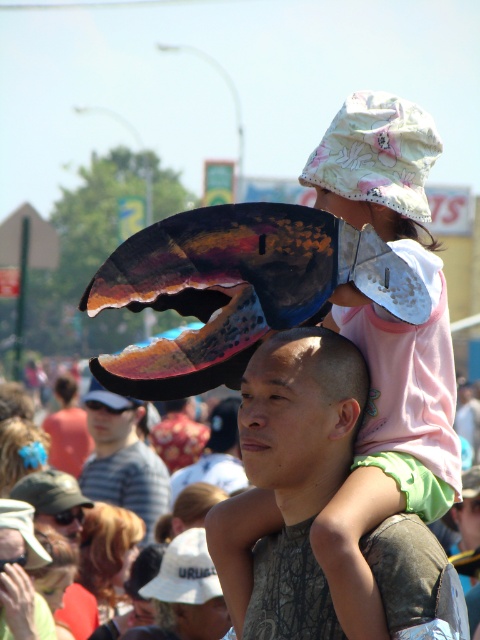
Does smooth skin head at center have a greater height compared to white matte visor at upper left?

Incorrect, smooth skin head at center's height is not larger of white matte visor at upper left's.

Describe the element at coordinates (301, 412) in the screenshot. This screenshot has width=480, height=640. I see `smooth skin head at center` at that location.

Describe the element at coordinates (301, 412) in the screenshot. I see `smooth skin head at center` at that location.

At what (x,y) coordinates should I click in order to perform the action: click on smooth skin head at center. Please return your answer as a coordinate pair (x, y). Image resolution: width=480 pixels, height=640 pixels. Looking at the image, I should click on (301, 412).

Does floral cotton bucket hat at upper center appear on the right side of white matte visor at upper left?

Correct, you'll find floral cotton bucket hat at upper center to the right of white matte visor at upper left.

Measure the distance between point (245,595) and camera.

Point (245,595) and camera are 58.40 meters apart from each other.

Where is `floral cotton bucket hat at upper center`? floral cotton bucket hat at upper center is located at coordinates (385, 346).

Does matte black shirt at center come behind striped cotton shirt at center?

No, it is in front of striped cotton shirt at center.

Who is more distant from viewer, (213, 554) or (87, 426)?

The point (87, 426) is behind.

The width and height of the screenshot is (480, 640). I want to click on matte black shirt at center, so click(291, 456).

Identify the location of matte black shirt at center. (291, 456).